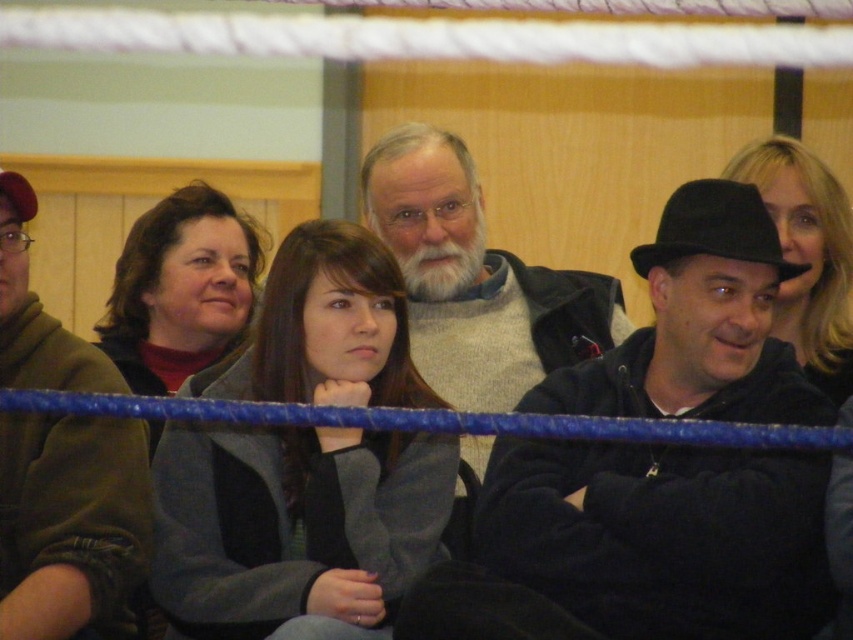
Question: Is black felt hat at right closer to camera compared to gray wool sweater at center?

Choices:
 (A) yes
 (B) no

Answer: (A)

Question: Is matte gray coat at center bigger than blonde hair at center?

Choices:
 (A) yes
 (B) no

Answer: (A)

Question: Estimate the real-world distances between objects in this image. Which object is farther from the gray wool sweater at center?

Choices:
 (A) gray woolen sweater at center
 (B) blonde hair at center
 (C) rubber ring at center

Answer: (C)

Question: Which object appears closest to the camera in this image?

Choices:
 (A) green fuzzy sweater at left
 (B) gray wool sweater at center
 (C) gray woolen sweater at center

Answer: (A)

Question: Does black felt hat at right appear over green fuzzy sweater at left?

Choices:
 (A) yes
 (B) no

Answer: (A)

Question: Considering the real-world distances, which object is farthest from the black felt hat at right?

Choices:
 (A) green fuzzy sweater at left
 (B) matte gray coat at center

Answer: (B)